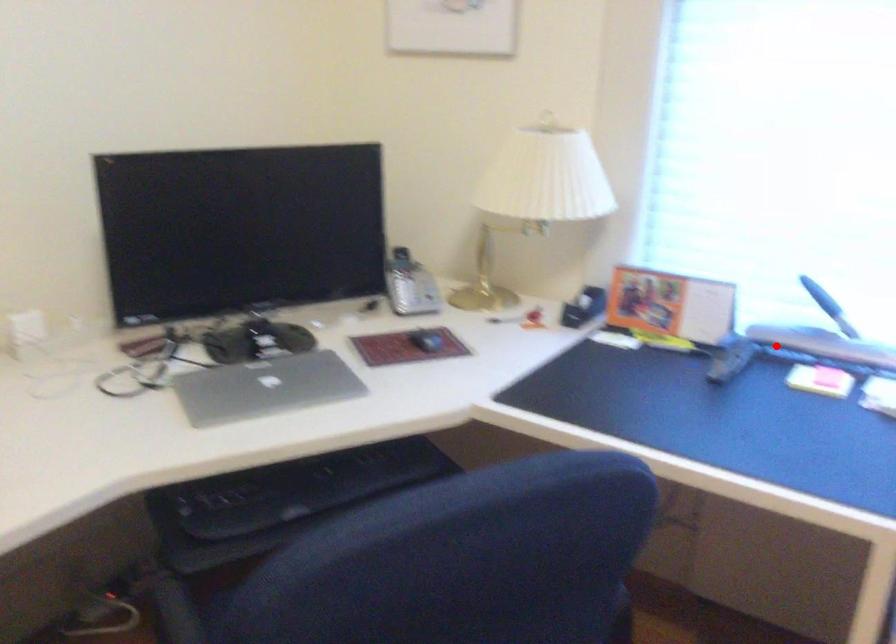
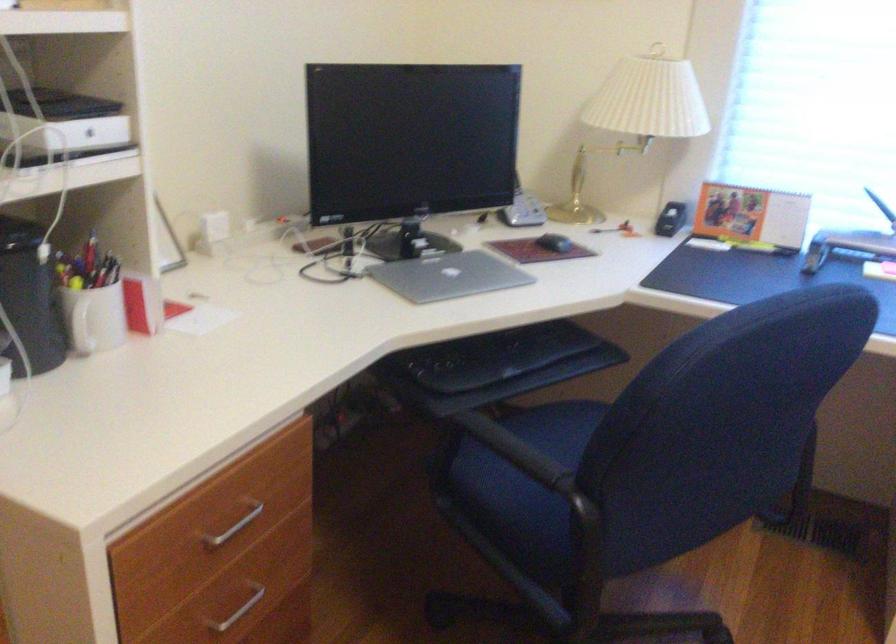
Question: A red point is marked in image1. In image2, is the corresponding 3D point closer to the camera or farther? Reply with the corresponding letter.

Choices:
 (A) The corresponding 3D point is closer.
 (B) The corresponding 3D point is farther.

Answer: (B)